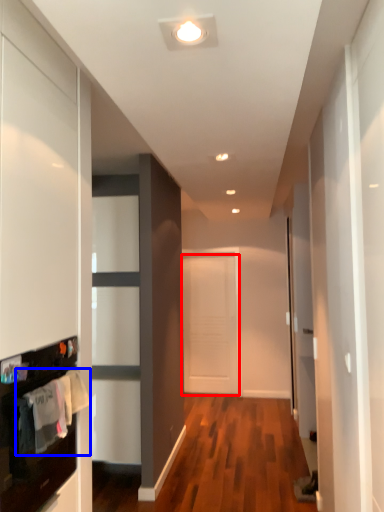
Question: Which object appears farthest to the camera in this image, door (highlighted by a red box) or laundry (highlighted by a blue box)?

Choices:
 (A) door
 (B) laundry

Answer: (A)